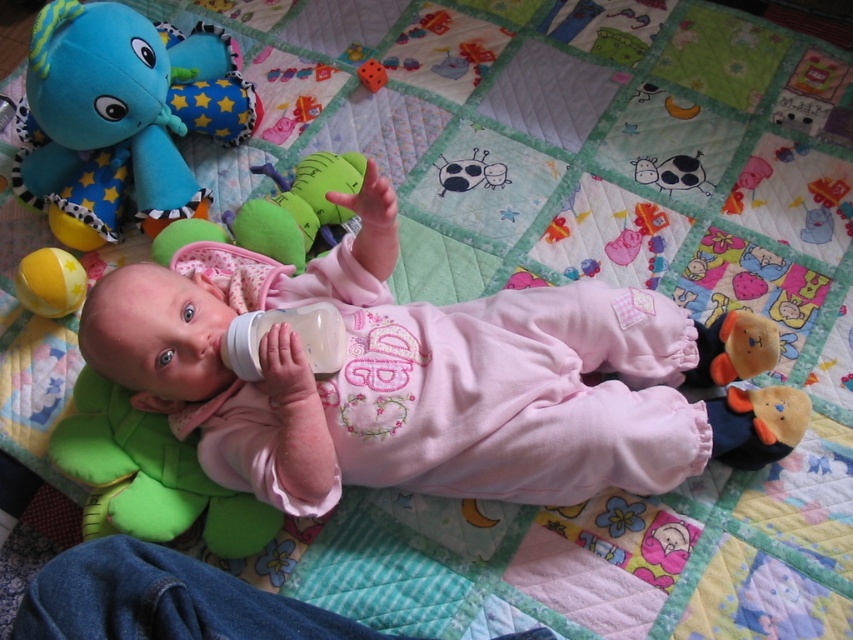
Is green plush toy at center shorter than rubber dice at center?

No.

Who is lower down, green plush toy at center or rubber dice at center?

green plush toy at center

Describe the element at coordinates (317, 188) in the screenshot. The width and height of the screenshot is (853, 640). I see `green plush toy at center` at that location.

Find the location of a particular element. The image size is (853, 640). green plush toy at center is located at coordinates (317, 188).

Does point (781, 438) come behind point (257, 310)?

No, it is in front of (257, 310).

The image size is (853, 640). I want to click on brown plush bear at lower right, so click(756, 424).

Between point (732, 432) and point (334, 321), which one is positioned behind?

Positioned behind is point (732, 432).

Identify the location of brown plush bear at lower right. (756, 424).

Can you confirm if soft plush elephant at upper left is bigger than soft plush bear at upper right?

Yes.

The width and height of the screenshot is (853, 640). Find the location of `soft plush elephant at upper left`. soft plush elephant at upper left is located at coordinates (120, 116).